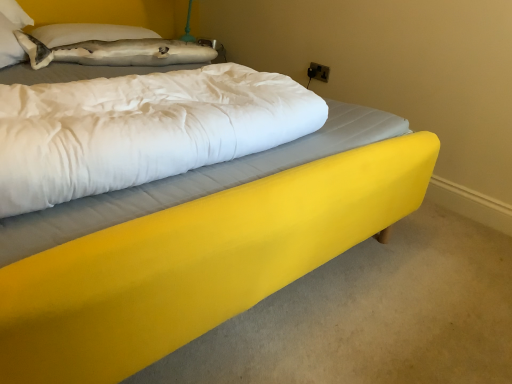
Where is `gray fabric pillow at upper left`? This screenshot has width=512, height=384. gray fabric pillow at upper left is located at coordinates (88, 33).

This screenshot has width=512, height=384. What do you see at coordinates (88, 33) in the screenshot?
I see `gray fabric pillow at upper left` at bounding box center [88, 33].

Describe the element at coordinates (140, 129) in the screenshot. I see `yellow fabric mattress at center` at that location.

Locate an element on the screen. yellow fabric mattress at center is located at coordinates pos(140,129).

You are a GUI agent. You are given a task and a screenshot of the screen. Output one action in this format:
    pyautogui.click(x=<x>, y=<y>)
    Task: Click on the gray fabric pillow at upper left
    This screenshot has height=384, width=512.
    Given the screenshot: What is the action you would take?
    pyautogui.click(x=88, y=33)

Between yellow fabric mattress at center and gray fabric pillow at upper left, which one appears on the left side from the viewer's perspective?

gray fabric pillow at upper left is more to the left.

Considering their positions, is yellow fabric mattress at center located in front of or behind gray fabric pillow at upper left?

yellow fabric mattress at center is positioned closer to the viewer than gray fabric pillow at upper left.

Between point (139, 170) and point (84, 40), which one is positioned in front?

Positioned in front is point (139, 170).

From the image's perspective, does yellow fabric mattress at center appear lower than gray fabric pillow at upper left?

Correct, yellow fabric mattress at center appears lower than gray fabric pillow at upper left in the image.

From a real-world perspective, which is physically above, yellow fabric mattress at center or gray fabric pillow at upper left?

yellow fabric mattress at center, from a real-world perspective.

From the picture: Can you confirm if yellow fabric mattress at center is wider than gray fabric pillow at upper left?

Correct, the width of yellow fabric mattress at center exceeds that of gray fabric pillow at upper left.

In the scene shown: Does yellow fabric mattress at center have a greater height compared to gray fabric pillow at upper left?

Correct, yellow fabric mattress at center is much taller as gray fabric pillow at upper left.

Which of these two, yellow fabric mattress at center or gray fabric pillow at upper left, is smaller?

Smaller between the two is gray fabric pillow at upper left.

Is yellow fabric mattress at center positioned beyond the bounds of gray fabric pillow at upper left?

yellow fabric mattress at center is positioned outside gray fabric pillow at upper left.

Is there a large distance between yellow fabric mattress at center and gray fabric pillow at upper left?

yellow fabric mattress at center is far away from gray fabric pillow at upper left.

Is yellow fabric mattress at center oriented towards gray fabric pillow at upper left?

No, yellow fabric mattress at center does not turn towards gray fabric pillow at upper left.

You are a GUI agent. You are given a task and a screenshot of the screen. Output one action in this format:
    pyautogui.click(x=<x>, y=<y>)
    Task: Click on the mattress lying below the gray fabric pillow at upper left (from the image's perspective)
    Image resolution: width=512 pixels, height=384 pixels.
    Given the screenshot: What is the action you would take?
    pyautogui.click(x=140, y=129)

Is gray fabric pillow at upper left to the right of yellow fabric mattress at center from the viewer's perspective?

In fact, gray fabric pillow at upper left is to the left of yellow fabric mattress at center.

Is gray fabric pillow at upper left in front of or behind yellow fabric mattress at center in the image?

gray fabric pillow at upper left is positioned farther from the viewer than yellow fabric mattress at center.

Is point (80, 40) positioned in front of point (184, 123)?

No.

From the image's perspective, relative to yellow fabric mattress at center, is gray fabric pillow at upper left above or below?

Based on their image positions, gray fabric pillow at upper left is located above yellow fabric mattress at center.

From a real-world perspective, is gray fabric pillow at upper left under yellow fabric mattress at center?

Yes, from a real-world perspective, gray fabric pillow at upper left is beneath yellow fabric mattress at center.

Considering the relative sizes of gray fabric pillow at upper left and yellow fabric mattress at center in the image provided, is gray fabric pillow at upper left wider than yellow fabric mattress at center?

In fact, gray fabric pillow at upper left might be narrower than yellow fabric mattress at center.

Between gray fabric pillow at upper left and yellow fabric mattress at center, which one has more height?

Standing taller between the two is yellow fabric mattress at center.

In the scene shown: Can you confirm if gray fabric pillow at upper left is bigger than yellow fabric mattress at center?

Actually, gray fabric pillow at upper left might be smaller than yellow fabric mattress at center.

Is gray fabric pillow at upper left positioned beyond the bounds of yellow fabric mattress at center?

gray fabric pillow at upper left is positioned outside yellow fabric mattress at center.

Are gray fabric pillow at upper left and yellow fabric mattress at center far apart?

Yes, gray fabric pillow at upper left is far from yellow fabric mattress at center.

Could you tell me if gray fabric pillow at upper left is facing yellow fabric mattress at center?

Yes, gray fabric pillow at upper left faces towards yellow fabric mattress at center.

In the scene shown: Can you tell me how much gray fabric pillow at upper left and yellow fabric mattress at center differ in facing direction?

They differ by 7.92 degrees in their facing directions.

Locate an element on the screen. This screenshot has width=512, height=384. mattress below the gray fabric pillow at upper left (from the image's perspective) is located at coordinates (140, 129).

At what (x,y) coordinates should I click in order to perform the action: click on mattress in front of the gray fabric pillow at upper left. Please return your answer as a coordinate pair (x, y). This screenshot has width=512, height=384. Looking at the image, I should click on (140, 129).

Locate an element on the screen. The width and height of the screenshot is (512, 384). pillow above the yellow fabric mattress at center (from the image's perspective) is located at coordinates (88, 33).